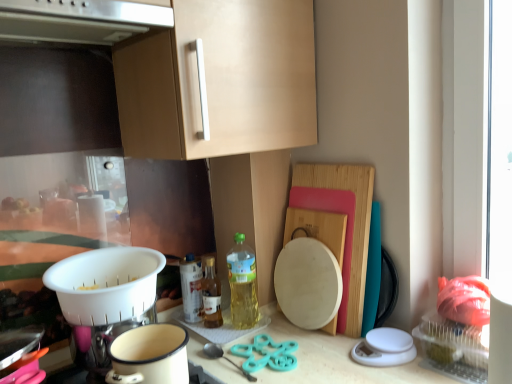
Question: Considering the relative positions of wooden cutting board at right and white plastic colander at lower left in the image provided, is wooden cutting board at right behind white plastic colander at lower left?

Choices:
 (A) no
 (B) yes

Answer: (B)

Question: Can you confirm if wooden cutting board at right is bigger than white plastic colander at lower left?

Choices:
 (A) yes
 (B) no

Answer: (A)

Question: Is wooden cutting board at right turned away from white plastic colander at lower left?

Choices:
 (A) yes
 (B) no

Answer: (B)

Question: Is wooden cutting board at right shorter than white plastic colander at lower left?

Choices:
 (A) yes
 (B) no

Answer: (B)

Question: Considering the relative positions of wooden cutting board at right and white plastic colander at lower left in the image provided, is wooden cutting board at right to the right of white plastic colander at lower left from the viewer's perspective?

Choices:
 (A) no
 (B) yes

Answer: (B)

Question: Does wooden cutting board at right have a smaller size compared to white plastic colander at lower left?

Choices:
 (A) yes
 (B) no

Answer: (B)

Question: Is teal plastic scissors at center looking in the opposite direction of translucent glass bottle at center, which is the second bottle in left-to-right order?

Choices:
 (A) no
 (B) yes

Answer: (A)

Question: Is translucent glass bottle at center, the second bottle positioned from the right, surrounded by teal plastic scissors at center?

Choices:
 (A) yes
 (B) no

Answer: (B)

Question: Is teal plastic scissors at center further to the viewer compared to translucent glass bottle at center, the second bottle positioned from the right?

Choices:
 (A) yes
 (B) no

Answer: (B)

Question: From a real-world perspective, is teal plastic scissors at center positioned over translucent glass bottle at center, which is the second bottle in left-to-right order, based on gravity?

Choices:
 (A) no
 (B) yes

Answer: (A)

Question: Can you confirm if teal plastic scissors at center is positioned to the right of translucent glass bottle at center, the second bottle positioned from the right?

Choices:
 (A) yes
 (B) no

Answer: (A)

Question: Does teal plastic scissors at center lie in front of translucent glass bottle at center, the second bottle positioned from the right?

Choices:
 (A) yes
 (B) no

Answer: (A)

Question: Is satin silver exhaust hood at upper center completely or partially outside of white enamel pot at lower center?

Choices:
 (A) yes
 (B) no

Answer: (A)